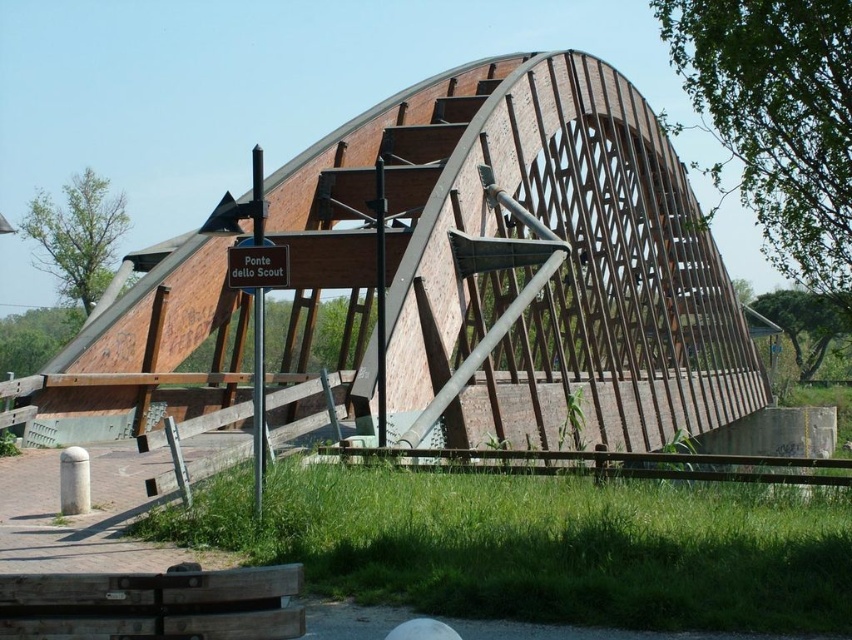
You are standing at the point labeled point (x=517, y=264) on the Scout Bridge. Based on the scene description, what type of material is the surface you are currently standing on made of?

The point (x=517, y=264) marks brick and concrete bridge at center, so the surface is made of brick and concrete.